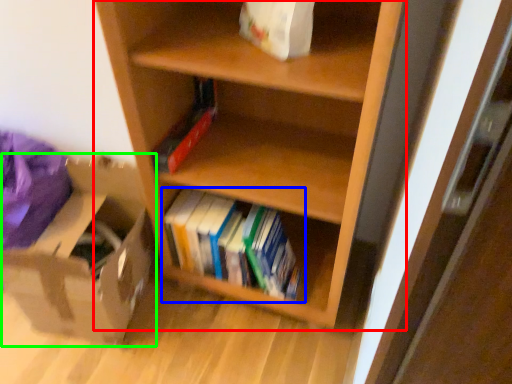
Question: Which is farther away from shelf (highlighted by a red box)? book (highlighted by a blue box) or cardboard box (highlighted by a green box)?

Choices:
 (A) book
 (B) cardboard box

Answer: (B)